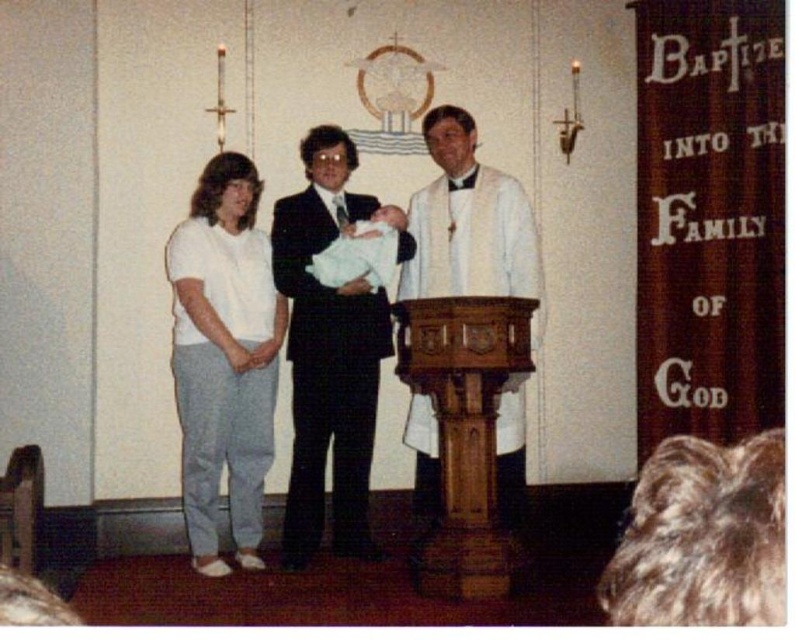
You are standing at the baptismal font and want to hand an item to the person closest to you. Which point, point A at point (216, 576) or point B at point (483, 294), is closer to you?

Point A at point (216, 576) is closer to you because it is in front of point B at point (483, 294).

Based on the photo, you are an interior designer observing the baptismal scene. You need to place a decorative rug between the white cotton pants at left and the white clothed man at center. Based on their widths, which object should the rug be wider than to ensure it covers both adequately?

The rug should be wider than the white clothed man at center since the white cotton pants at left has a lesser width compared to white clothed man at center, ensuring the rug can cover both adequately.

You are an interior designer planning to place a new rug in the church. The rug must be large enough to cover both the white cotton pants at left and the white soft cloth at center. Based on the scene description, which object requires the rug to be larger in size?

The white cotton pants at left requires the rug to be larger in size because it is bigger than the white soft cloth at center.